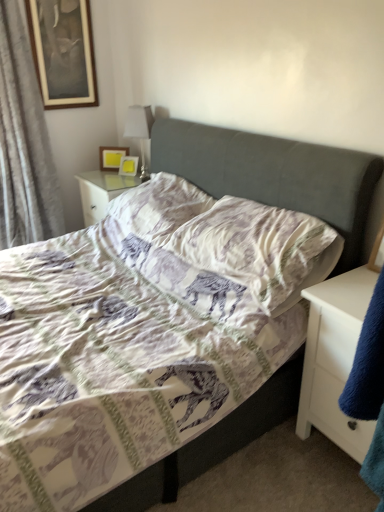
Locate an element on the screen. matte yellow picture frame at upper left, arranged as the 2th picture frame when viewed from the right is located at coordinates (111, 157).

Where is `white matte nightstand at right`? This screenshot has width=384, height=512. white matte nightstand at right is located at coordinates (334, 359).

What is the approximate width of gray fabric curtain at left?

It is 38.31 centimeters.

The width and height of the screenshot is (384, 512). Identify the location of matte yellow picture frame at upper left, arranged as the 2th picture frame when viewed from the right. (111, 157).

Can you confirm if matte yellow picture frame at upper left, the 2th picture frame when ordered from left to right, is taller than wooden-framed picture at upper left, which is counted as the third picture frame, starting from the bottom?

In fact, matte yellow picture frame at upper left, the 2th picture frame when ordered from left to right, may be shorter than wooden-framed picture at upper left, which is counted as the third picture frame, starting from the bottom.

Is point (118, 152) positioned in front of point (87, 87)?

No, it is not.

Is matte yellow picture frame at upper left, which appears as the second picture frame when viewed from the top, facing towards wooden-framed picture at upper left, which appears as the third picture frame when viewed from the right?

No.

Looking at this image, which object is closer to the camera, matte yellow picture frame at upper left, arranged as the 2th picture frame when viewed from the right, or wooden-framed picture at upper left, which is the first picture frame from left to right?

wooden-framed picture at upper left, which is the first picture frame from left to right, is more forward.

Is white fabric pillow at center, marked as the second pillow in a front-to-back arrangement, inside the boundaries of printed fabric pillow at center, the 2th pillow from the back, or outside?

white fabric pillow at center, marked as the second pillow in a front-to-back arrangement, exists outside the volume of printed fabric pillow at center, the 2th pillow from the back.

What's the angular difference between white fabric pillow at center, marked as the second pillow in a front-to-back arrangement, and printed fabric pillow at center, the 2th pillow from the back,'s facing directions?

The facing directions of white fabric pillow at center, marked as the second pillow in a front-to-back arrangement, and printed fabric pillow at center, the 2th pillow from the back, are 0.00021 degrees apart.

From the image's perspective, is white fabric pillow at center, marked as the second pillow in a front-to-back arrangement, located above printed fabric pillow at center, the 2th pillow from the back?

Indeed, from the image's perspective, white fabric pillow at center, marked as the second pillow in a front-to-back arrangement, is shown above printed fabric pillow at center, the 2th pillow from the back.

Locate an element on the screen. pillow that is in front of the white fabric pillow at center, arranged as the first pillow when viewed from the back is located at coordinates (260, 249).

Does point (99, 153) come behind point (49, 217)?

Yes.

Would you consider matte yellow picture frame at upper left, which appears as the second picture frame when viewed from the top, to be distant from gray fabric curtain at left?

No, matte yellow picture frame at upper left, which appears as the second picture frame when viewed from the top, is not far away from gray fabric curtain at left.

Who is bigger, matte yellow picture frame at upper left, which ranks as the 2th picture frame in bottom-to-top order, or gray fabric curtain at left?

With larger size is gray fabric curtain at left.

Can you confirm if printed fabric pillow at center, which ranks as the first pillow in front-to-back order, is positioned to the right of white glossy table lamp at upper center?

Yes, printed fabric pillow at center, which ranks as the first pillow in front-to-back order, is to the right of white glossy table lamp at upper center.

Which of these two, printed fabric pillow at center, the 2th pillow from the back, or white glossy table lamp at upper center, stands taller?

Standing taller between the two is white glossy table lamp at upper center.

How many degrees apart are the facing directions of printed fabric pillow at center, which ranks as the first pillow in front-to-back order, and white glossy table lamp at upper center?

printed fabric pillow at center, which ranks as the first pillow in front-to-back order, and white glossy table lamp at upper center are facing 1.46 degrees away from each other.

Is printed fabric pillow at center, the 2th pillow from the back, oriented towards white matte nightstand at right?

No, printed fabric pillow at center, the 2th pillow from the back, is not turned towards white matte nightstand at right.

Considering the sizes of printed fabric pillow at center, which ranks as the first pillow in front-to-back order, and white matte nightstand at right in the image, is printed fabric pillow at center, which ranks as the first pillow in front-to-back order, taller or shorter than white matte nightstand at right?

Considering their sizes, printed fabric pillow at center, which ranks as the first pillow in front-to-back order, has less height than white matte nightstand at right.

Between printed fabric pillow at center, which ranks as the first pillow in front-to-back order, and white matte nightstand at right, which one has smaller width?

With smaller width is printed fabric pillow at center, which ranks as the first pillow in front-to-back order.

Are printed fabric pillow at center, which ranks as the first pillow in front-to-back order, and white matte nightstand at right located far from each other?

That's not correct — printed fabric pillow at center, which ranks as the first pillow in front-to-back order, is a little close to white matte nightstand at right.

Which of these two, matte yellow picture frame at upper left, the 2th picture frame when ordered from left to right, or white matte nightstand at right, is bigger?

Bigger between the two is white matte nightstand at right.

Can you confirm if matte yellow picture frame at upper left, which ranks as the 2th picture frame in bottom-to-top order, is positioned to the left of white matte nightstand at right?

Yes.

From the image's perspective, between matte yellow picture frame at upper left, which appears as the second picture frame when viewed from the top, and white matte nightstand at right, who is located below?

Result: white matte nightstand at right is shown below in the image.

Is matte yellow picture frame at upper left, the 2th picture frame when ordered from left to right, positioned behind white matte nightstand at right?

Yes.

Who is shorter, wooden-framed picture at upper left, which is the first picture frame from left to right, or gray fabric curtain at left?

wooden-framed picture at upper left, which is the first picture frame from left to right, is shorter.

From the image's perspective, is wooden-framed picture at upper left, which is counted as the third picture frame, starting from the bottom, over gray fabric curtain at left?

Indeed, from the image's perspective, wooden-framed picture at upper left, which is counted as the third picture frame, starting from the bottom, is shown above gray fabric curtain at left.

Locate an element on the screen. picture frame located above the gray fabric curtain at left (from a real-world perspective) is located at coordinates (63, 52).

In the scene shown: Can you tell me how much wooden-framed picture at upper left, placed as the 1th picture frame when sorted from top to bottom, and gray fabric curtain at left differ in facing direction?

The angle between the facing direction of wooden-framed picture at upper left, placed as the 1th picture frame when sorted from top to bottom, and the facing direction of gray fabric curtain at left is 0.00229 degrees.

From the image's perspective, which picture frame is the 1st one below the wooden-framed picture at upper left, which is the first picture frame from left to right? Please provide its 2D coordinates.

[(111, 157)]

Find the location of a particular element. pillow lying behind the printed fabric pillow at center, which ranks as the first pillow in front-to-back order is located at coordinates (159, 207).

Which object lies further to the anchor point printed fabric pillow at center, which ranks as the first pillow in front-to-back order, white matte nightstand at right or wooden-framed picture at upper left, which is the first picture frame from left to right?

wooden-framed picture at upper left, which is the first picture frame from left to right, lies further to printed fabric pillow at center, which ranks as the first pillow in front-to-back order, than the other object.

Based on the photo, from the image, which object appears to be farther from wooden-framed picture at upper left, which appears as the third picture frame when viewed from the right, white matte nightstand at right or gray fabric curtain at left?

white matte nightstand at right.

Based on their spatial positions, is matte yellow picture frame at upper left, which ranks as the 2th picture frame in bottom-to-top order, or matte yellow picture frame at upper center, the first picture frame in the right-to-left sequence, closer to white matte nightstand at right?

matte yellow picture frame at upper center, the first picture frame in the right-to-left sequence, is closer to white matte nightstand at right.

Based on the photo, looking at the image, which one is located closer to white matte nightstand at right, printed fabric pillow at center, the 2th pillow from the back, or wooden-framed picture at upper left, which appears as the third picture frame when viewed from the right?

The object closer to white matte nightstand at right is printed fabric pillow at center, the 2th pillow from the back.

Looking at the image, which one is located further to gray fabric curtain at left, matte yellow picture frame at upper center, which is counted as the third picture frame, starting from the top, or wooden-framed picture at upper left, which is counted as the third picture frame, starting from the bottom?

Based on the image, matte yellow picture frame at upper center, which is counted as the third picture frame, starting from the top, appears to be further to gray fabric curtain at left.

Looking at the image, which one is located closer to matte yellow picture frame at upper left, arranged as the 2th picture frame when viewed from the right, white fabric pillow at center, arranged as the first pillow when viewed from the back, or printed fabric pillow at center, the 2th pillow from the back?

white fabric pillow at center, arranged as the first pillow when viewed from the back.

When comparing their distances from printed fabric pillow at center, which ranks as the first pillow in front-to-back order, does white glossy table lamp at upper center or white matte nightstand at right seem further?

Among the two, white glossy table lamp at upper center is located further to printed fabric pillow at center, which ranks as the first pillow in front-to-back order.

Consider the image. When comparing their distances from matte yellow picture frame at upper center, the first picture frame in the right-to-left sequence, does white glossy table lamp at upper center or matte yellow picture frame at upper left, the 2th picture frame when ordered from left to right, seem further?

Among the two, white glossy table lamp at upper center is located further to matte yellow picture frame at upper center, the first picture frame in the right-to-left sequence.

You are a GUI agent. You are given a task and a screenshot of the screen. Output one action in this format:
    pyautogui.click(x=<x>, y=<y>)
    Task: Click on the table lamp between wooden-framed picture at upper left, which is the first picture frame from left to right, and matte yellow picture frame at upper left, arranged as the 2th picture frame when viewed from the right, vertically
    
    Given the screenshot: What is the action you would take?
    pyautogui.click(x=139, y=130)

What are the coordinates of `pillow located between white fabric pillow at center, marked as the second pillow in a front-to-back arrangement, and white matte nightstand at right in the left-right direction` in the screenshot? It's located at click(x=260, y=249).

Find the location of a particular element. table lamp between wooden-framed picture at upper left, placed as the 1th picture frame when sorted from top to bottom, and matte yellow picture frame at upper center, placed as the third picture frame when sorted from left to right, from top to bottom is located at coordinates (139, 130).

Find the location of a particular element. The width and height of the screenshot is (384, 512). table lamp between gray fabric curtain at left and white fabric pillow at center, marked as the second pillow in a front-to-back arrangement, from left to right is located at coordinates (139, 130).